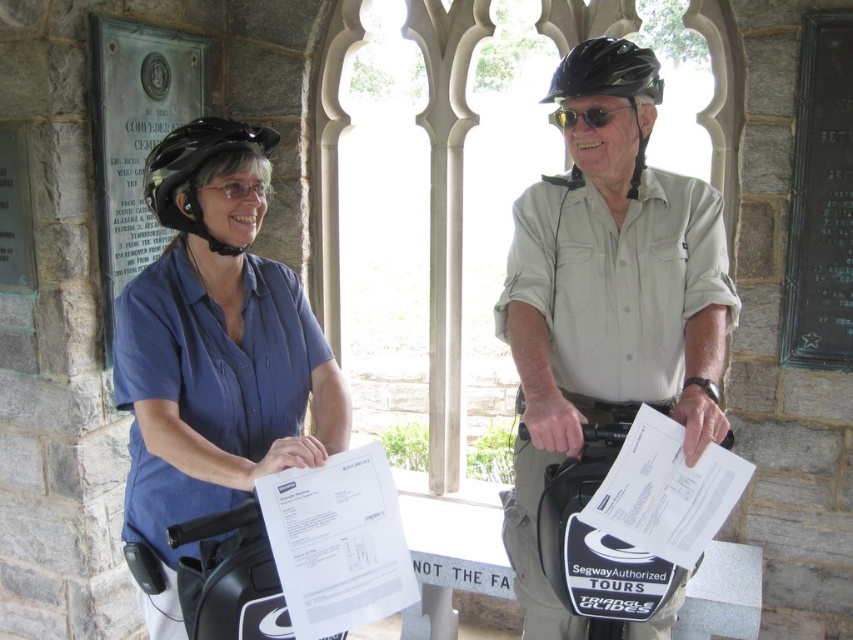
Question: Considering the real-world distances, which object is farthest from the matte blue shirt at center?

Choices:
 (A) khaki cotton shirt at center
 (B) black matte bicycle helmet at upper center

Answer: (B)

Question: Does black matte bicycle helmet at upper center appear under black matte helmet at upper center?

Choices:
 (A) yes
 (B) no

Answer: (A)

Question: Which point appears closest to the camera in this image?

Choices:
 (A) (146, 173)
 (B) (567, 116)
 (C) (558, 83)
 (D) (660, 609)

Answer: (A)

Question: Which object appears farthest from the camera in this image?

Choices:
 (A) black reflective sunglasses at upper center
 (B) black matte bicycle helmet at upper center
 (C) khaki cotton shirt at center

Answer: (A)

Question: Is the position of khaki cotton shirt at center more distant than that of black matte helmet at upper center?

Choices:
 (A) yes
 (B) no

Answer: (B)

Question: Does matte blue shirt at center have a greater width compared to black matte helmet at upper center?

Choices:
 (A) no
 (B) yes

Answer: (B)